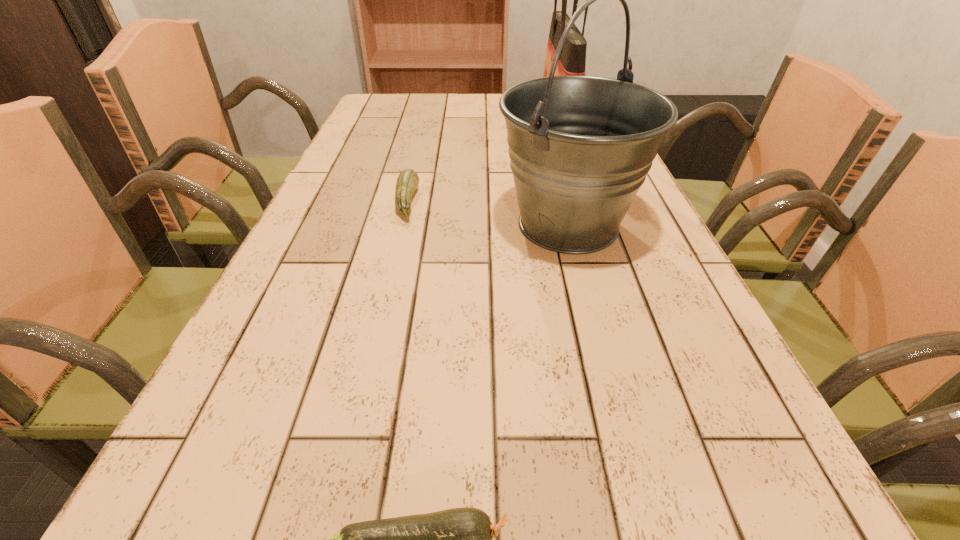
At what (x,y) coordinates should I click in order to perform the action: click on free region that satisfies the following two spatial constraints: 1. on the front-facing side of the tallest object; 2. on the front side of the second tallest object. Please return your answer as a coordinate pair (x, y). This screenshot has width=960, height=540. Looking at the image, I should click on (589, 225).

Locate an element on the screen. vacant area that satisfies the following two spatial constraints: 1. at the stem end of the farther zucchini; 2. on the left side of the third shortest object is located at coordinates (401, 225).

This screenshot has width=960, height=540. Find the location of `vacant space that satisfies the following two spatial constraints: 1. at the stem end of the farther zucchini; 2. on the left side of the second tallest object`. vacant space that satisfies the following two spatial constraints: 1. at the stem end of the farther zucchini; 2. on the left side of the second tallest object is located at coordinates (401, 225).

You are a GUI agent. You are given a task and a screenshot of the screen. Output one action in this format:
    pyautogui.click(x=<x>, y=<y>)
    Task: Click on the free spot that satisfies the following two spatial constraints: 1. at the stem end of the farther zucchini; 2. on the left side of the third shortest object
    
    Given the screenshot: What is the action you would take?
    pyautogui.click(x=401, y=225)